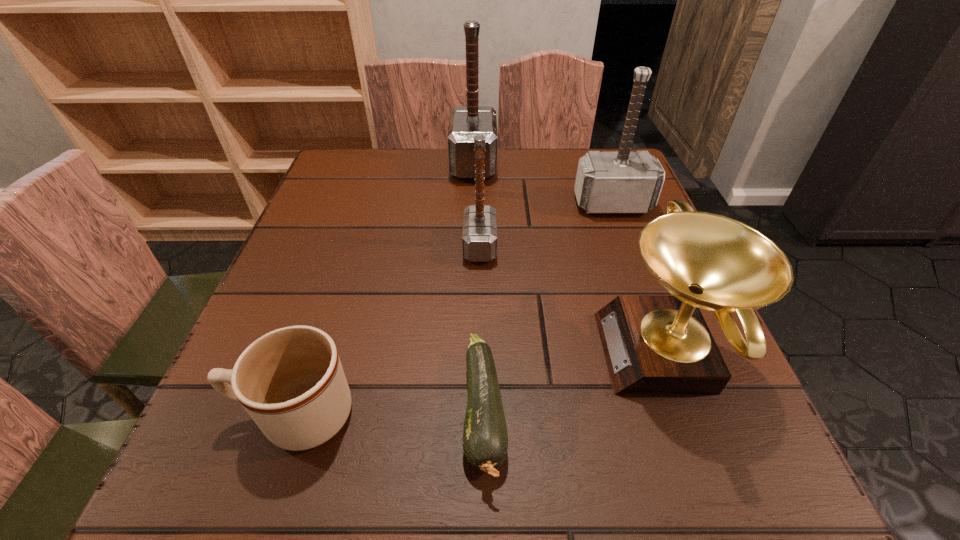
Image resolution: width=960 pixels, height=540 pixels. I want to click on vacant space located 0.270m for striking with the head of the second farthest object, so click(x=652, y=309).

The image size is (960, 540). Identify the location of vacant space located 0.110m on the striking surface of the fourth nearest object. (549, 246).

Locate an element on the screen. This screenshot has width=960, height=540. free location located 0.400m on the front-facing side of the award is located at coordinates (357, 353).

Identify the location of vacant space situated 0.060m on the front-facing side of the award. Image resolution: width=960 pixels, height=540 pixels. (566, 353).

Where is `vacant space located 0.400m on the front-facing side of the award`? vacant space located 0.400m on the front-facing side of the award is located at coordinates (357, 353).

The width and height of the screenshot is (960, 540). I want to click on mug located at the near edge, so click(x=290, y=381).

Identify the location of zucchini present at the near edge. (485, 439).

Where is `object located at the left edge`? object located at the left edge is located at coordinates (290, 381).

Where is `hammer located at the right edge`? The image size is (960, 540). hammer located at the right edge is located at coordinates (623, 182).

At what (x,y) coordinates should I click in order to perform the action: click on award located at the right edge. Please return your answer as a coordinate pair (x, y). The width and height of the screenshot is (960, 540). Looking at the image, I should click on (653, 344).